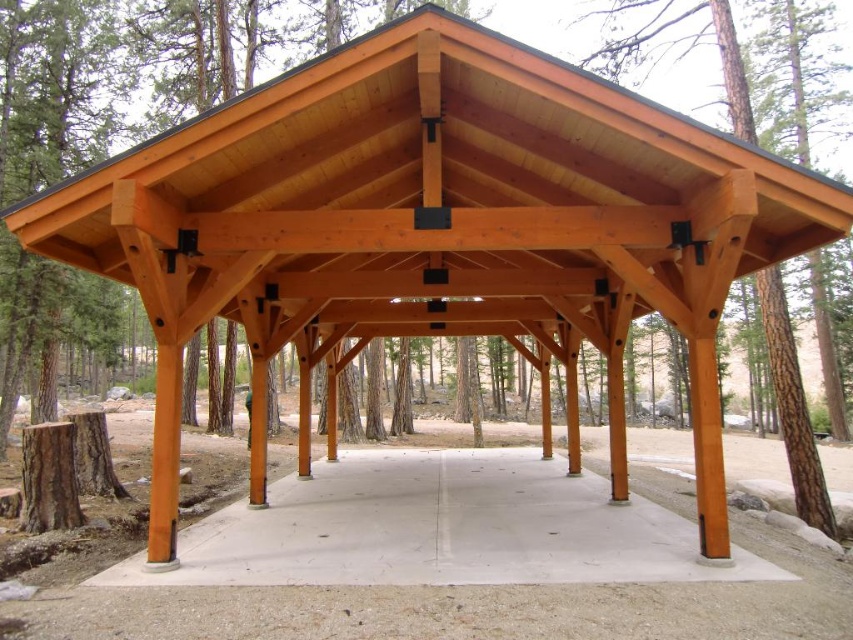
You are designing a garden layout and need to place a 2m wide statue between the concrete at center and the natural wood tree at center. Can the statue fit between them without overlapping either?

The concrete at center is narrower than the natural wood tree at center. However, the exact distance between them isn not provided in the description. To determine if the statue can fit, you would need to measure the space between the two objects to ensure it is at least 2 meters wide.